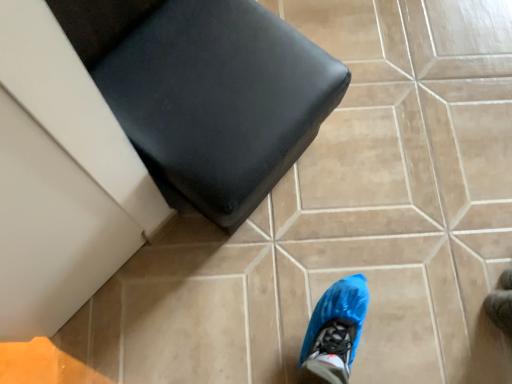
Where is `black leather chair at upper left`? Image resolution: width=512 pixels, height=384 pixels. black leather chair at upper left is located at coordinates (207, 93).

The image size is (512, 384). What do you see at coordinates (207, 93) in the screenshot? I see `black leather chair at upper left` at bounding box center [207, 93].

Where is `black leather chair at upper left`? The height and width of the screenshot is (384, 512). black leather chair at upper left is located at coordinates (207, 93).